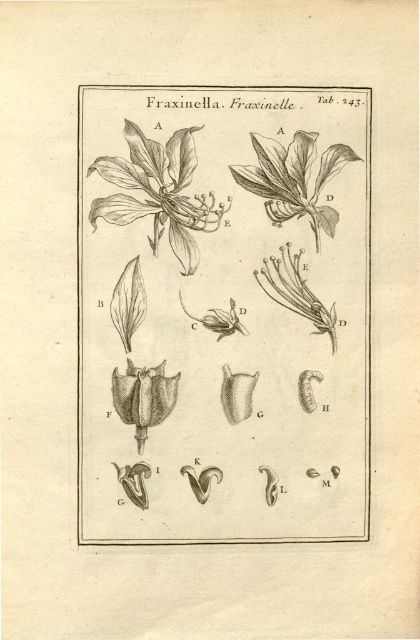
Does black ink drawing of flower at upper center have a lesser height compared to brown textured flower at upper left?

In fact, black ink drawing of flower at upper center may be taller than brown textured flower at upper left.

Can you confirm if black ink drawing of flower at upper center is positioned to the right of brown textured flower at upper left?

Yes, black ink drawing of flower at upper center is to the right of brown textured flower at upper left.

The image size is (420, 640). I want to click on black ink drawing of flower at upper center, so click(223, 314).

Consider the image. Is black ink drawing of flower at upper center wider than brown wood flower at upper center?

Indeed, black ink drawing of flower at upper center has a greater width compared to brown wood flower at upper center.

Who is shorter, black ink drawing of flower at upper center or brown wood flower at upper center?

brown wood flower at upper center is shorter.

Between point (157, 148) and point (280, 145), which one is positioned in front?

Point (157, 148) is more forward.

The image size is (420, 640). Identify the location of black ink drawing of flower at upper center. (223, 314).

Can you confirm if brown textured flower at upper left is shorter than brown wood flower at upper center?

In fact, brown textured flower at upper left may be taller than brown wood flower at upper center.

Can you confirm if brown textured flower at upper left is positioned above brown wood flower at upper center?

No, brown textured flower at upper left is not above brown wood flower at upper center.

Describe the element at coordinates (157, 192) in the screenshot. The image size is (420, 640). I see `brown textured flower at upper left` at that location.

This screenshot has height=640, width=420. In order to click on brown textured flower at upper left in this screenshot , I will do `click(157, 192)`.